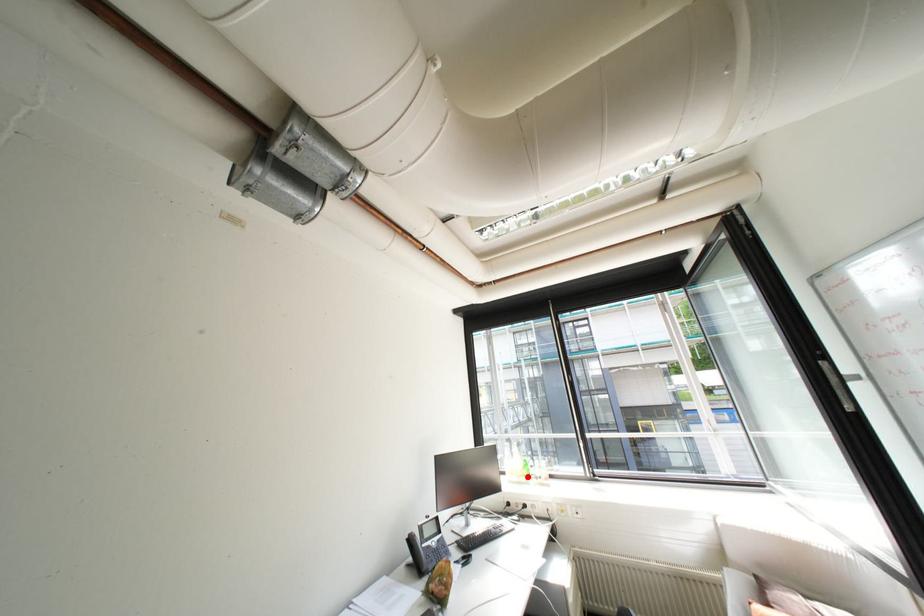
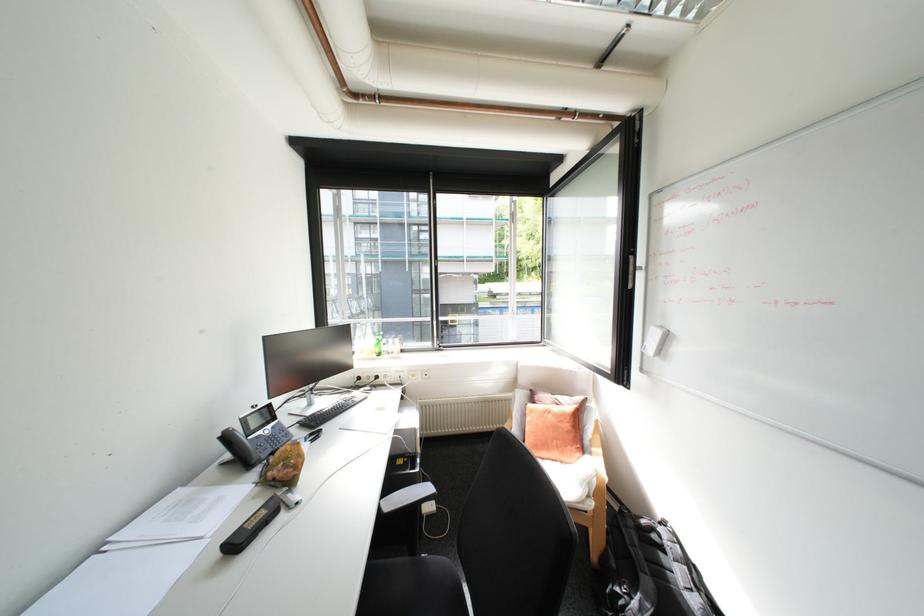
In the second image, find the point that corresponds to the highlighted location in the first image.

(379, 354)